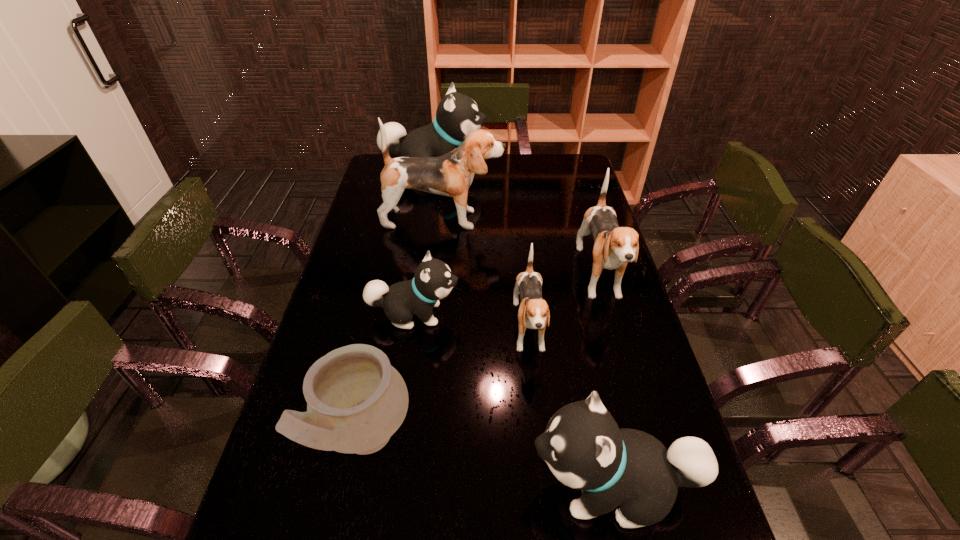
Locate an element on the screen. The image size is (960, 540). pottery located at the left edge is located at coordinates (356, 400).

Find the location of a particular element. object that is at the far left corner is located at coordinates (457, 115).

At what (x,y) coordinates should I click in order to perform the action: click on free region at the far edge of the desktop. Please return your answer as a coordinate pair (x, y). Image resolution: width=960 pixels, height=540 pixels. Looking at the image, I should click on (516, 157).

Locate an element on the screen. vacant space at the left edge of the desktop is located at coordinates (361, 202).

Find the location of a particular element. This screenshot has width=960, height=540. vacant area at the right edge of the desktop is located at coordinates (603, 276).

Where is `vacant region between the farthest brown puppy and the nearest puppy`? This screenshot has height=540, width=960. vacant region between the farthest brown puppy and the nearest puppy is located at coordinates (527, 353).

This screenshot has height=540, width=960. I want to click on free spot between the leftmost brown puppy and the pottery, so click(x=403, y=329).

Locate an element on the screen. Image resolution: width=960 pixels, height=540 pixels. vacant point located between the rightmost brown puppy and the smallest brown puppy is located at coordinates (564, 305).

Where is `vacant region between the second farthest white puppy and the second biggest white puppy`? Image resolution: width=960 pixels, height=540 pixels. vacant region between the second farthest white puppy and the second biggest white puppy is located at coordinates (513, 400).

At what (x,y) coordinates should I click in order to perform the action: click on free space between the smallest white puppy and the farthest puppy. Please return your answer as a coordinate pair (x, y). The height and width of the screenshot is (540, 960). Looking at the image, I should click on (423, 242).